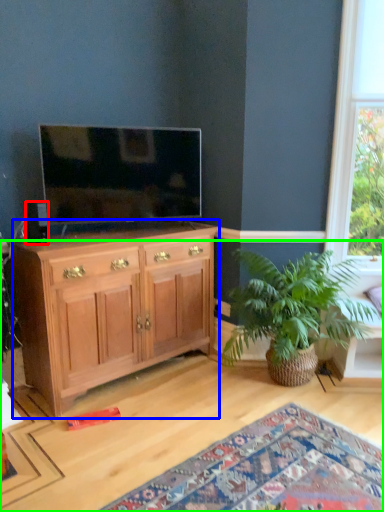
Question: Which is farther away from loudspeaker (highlighted by a red box)? cabinetry (highlighted by a blue box) or desk (highlighted by a green box)?

Choices:
 (A) cabinetry
 (B) desk

Answer: (B)